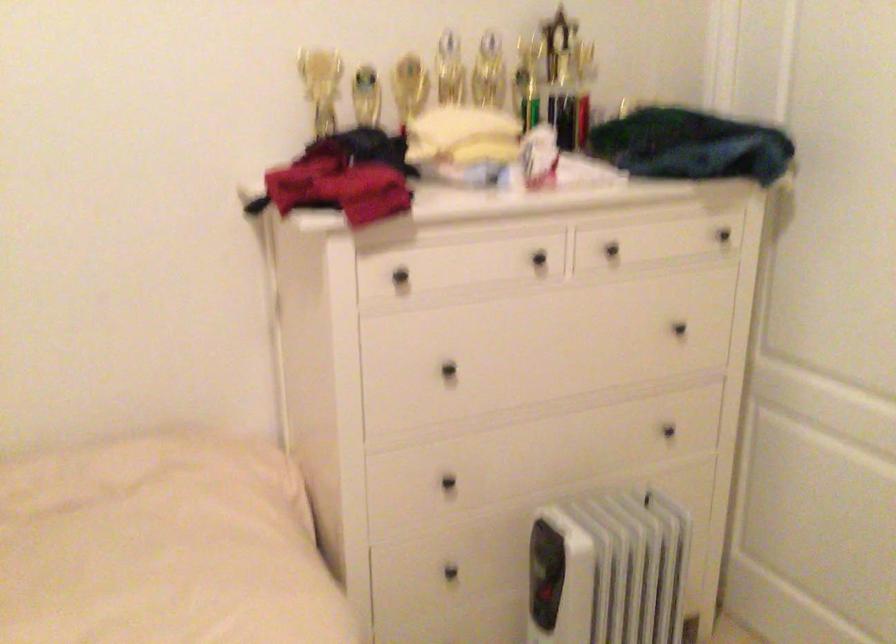
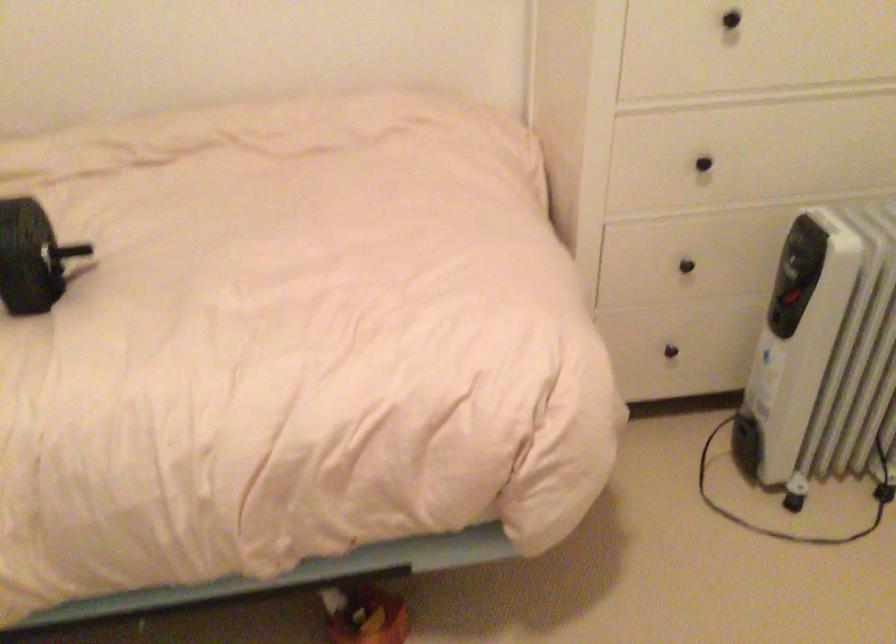
Find the pixel in the second image that matches the point at 445,486 in the first image.

(702, 164)